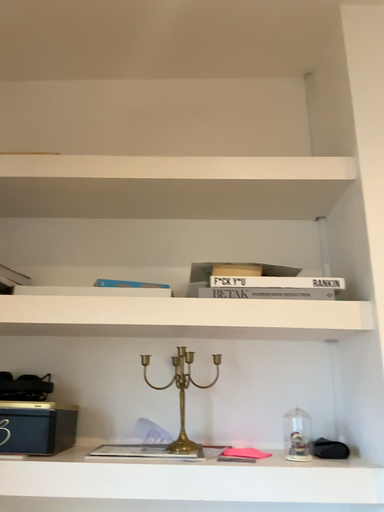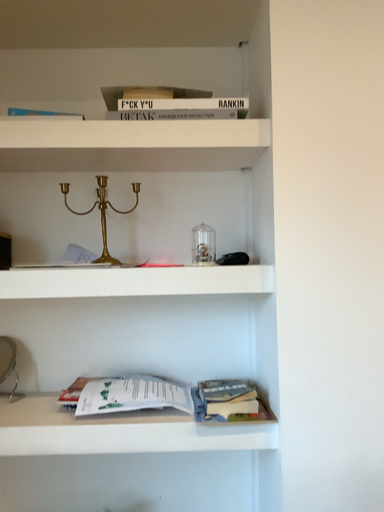
Question: Which way did the camera rotate in the video?

Choices:
 (A) rotated downward
 (B) rotated upward

Answer: (A)